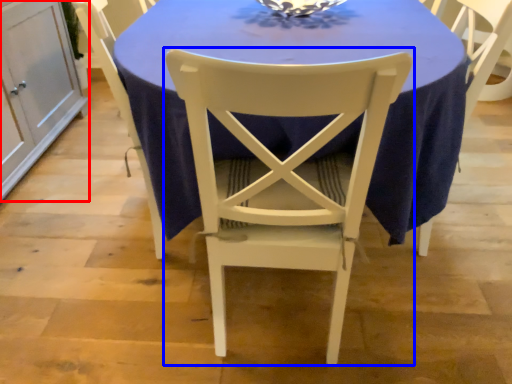
Question: Which object appears farthest to the camera in this image, cabinetry (highlighted by a red box) or chair (highlighted by a blue box)?

Choices:
 (A) cabinetry
 (B) chair

Answer: (A)